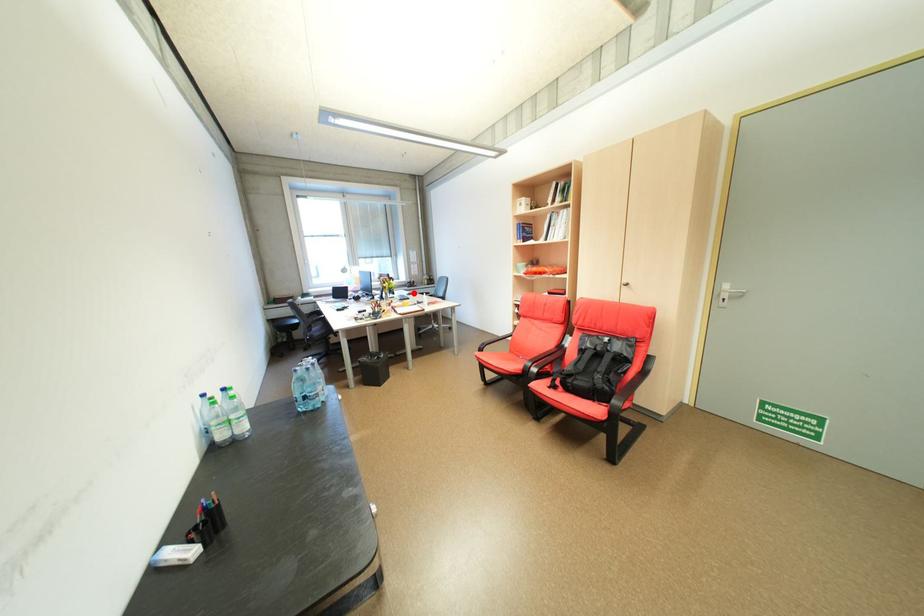
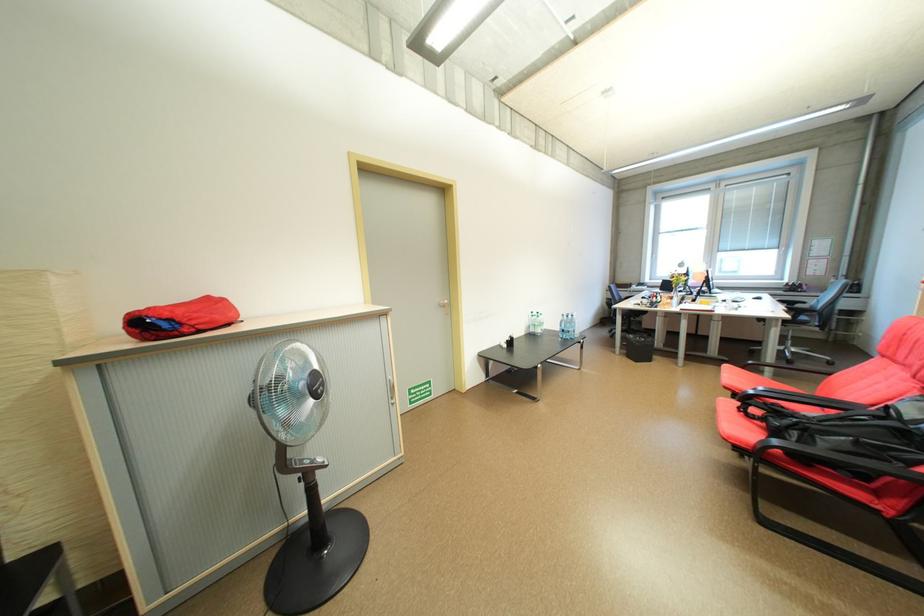
Locate, in the second image, the point that corresponds to the highlighted location in the first image.

(758, 296)